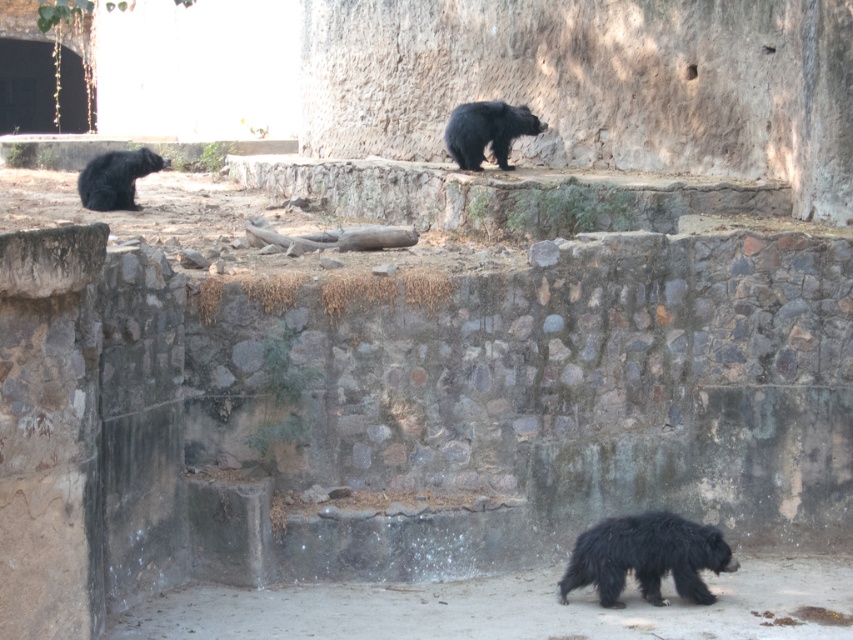
Question: Is shaggy black bear at lower center smaller than shiny black bear at lower left?

Choices:
 (A) no
 (B) yes

Answer: (B)

Question: Which object is farther from the camera taking this photo?

Choices:
 (A) shiny black bear at lower left
 (B) black fuzzy bear at upper center
 (C) shaggy black bear at lower center

Answer: (A)

Question: Observing the image, what is the correct spatial positioning of shaggy black bear at lower center in reference to black fuzzy bear at upper center?

Choices:
 (A) above
 (B) below

Answer: (B)

Question: Estimate the real-world distances between objects in this image. Which object is farther from the shiny black bear at lower left?

Choices:
 (A) black fuzzy bear at upper center
 (B) shaggy black bear at lower center

Answer: (B)

Question: Does shaggy black bear at lower center have a larger size compared to black fuzzy bear at upper center?

Choices:
 (A) no
 (B) yes

Answer: (A)

Question: Which of these objects is positioned closest to the shiny black bear at lower left?

Choices:
 (A) black fuzzy bear at upper center
 (B) shaggy black bear at lower center

Answer: (A)